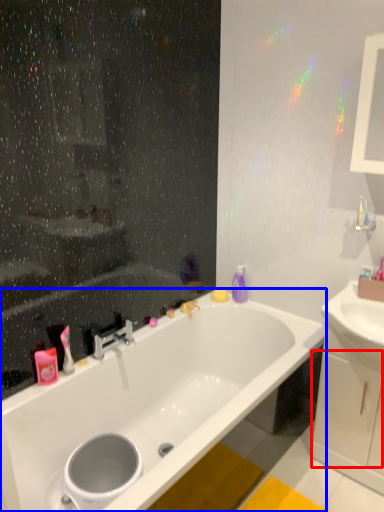
Question: Which object is further to the camera taking this photo, drawer (highlighted by a red box) or bathtub (highlighted by a blue box)?

Choices:
 (A) drawer
 (B) bathtub

Answer: (A)